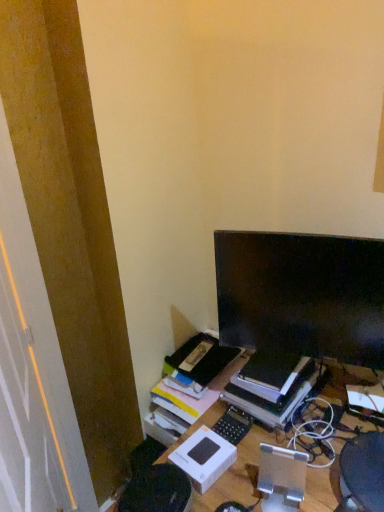
Question: From the image's perspective, is white matte cardboard box at center located beneath hardcover book at center?

Choices:
 (A) no
 (B) yes

Answer: (B)

Question: Considering the relative sizes of white matte cardboard box at center and hardcover book at center in the image provided, is white matte cardboard box at center taller than hardcover book at center?

Choices:
 (A) yes
 (B) no

Answer: (B)

Question: Would you consider white matte cardboard box at center to be distant from hardcover book at center?

Choices:
 (A) yes
 (B) no

Answer: (B)

Question: Is white matte cardboard box at center to the left of hardcover book at center from the viewer's perspective?

Choices:
 (A) no
 (B) yes

Answer: (B)

Question: Does white matte cardboard box at center turn towards hardcover book at center?

Choices:
 (A) no
 (B) yes

Answer: (B)

Question: Can you confirm if white matte cardboard box at center is smaller than hardcover book at center?

Choices:
 (A) no
 (B) yes

Answer: (B)

Question: Does black matte keyboard at center appear on the right side of matte black monitor at upper right?

Choices:
 (A) yes
 (B) no

Answer: (B)

Question: Is black matte keyboard at center shorter than matte black monitor at upper right?

Choices:
 (A) no
 (B) yes

Answer: (B)

Question: Considering the relative sizes of black matte keyboard at center and matte black monitor at upper right in the image provided, is black matte keyboard at center thinner than matte black monitor at upper right?

Choices:
 (A) yes
 (B) no

Answer: (B)

Question: Is black matte keyboard at center closer to camera compared to matte black monitor at upper right?

Choices:
 (A) yes
 (B) no

Answer: (B)

Question: Can you confirm if black matte keyboard at center is positioned to the left of matte black monitor at upper right?

Choices:
 (A) yes
 (B) no

Answer: (A)

Question: Does black matte keyboard at center have a greater height compared to matte black monitor at upper right?

Choices:
 (A) yes
 (B) no

Answer: (B)

Question: Could you tell me if black matte keyboard at center is facing white matte cardboard box at center?

Choices:
 (A) yes
 (B) no

Answer: (A)